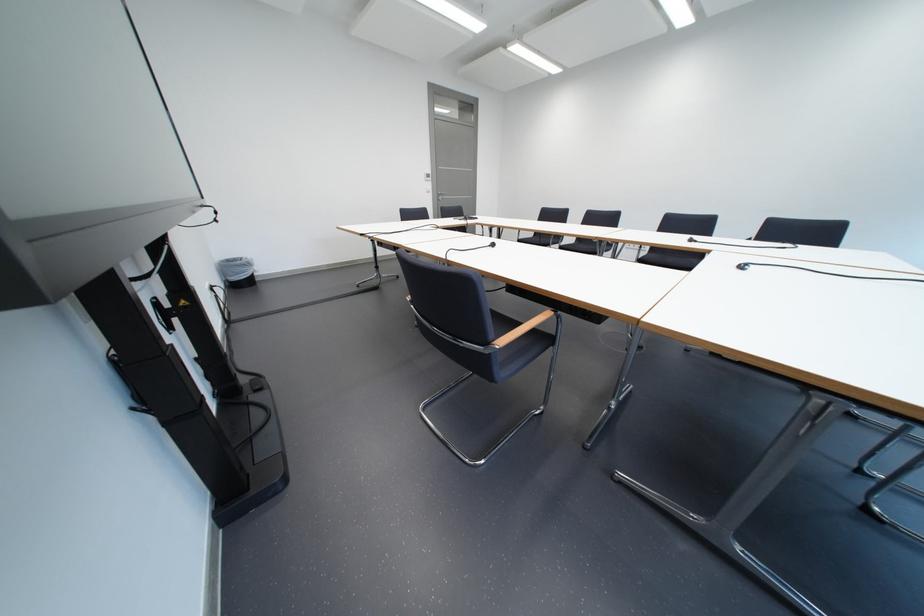
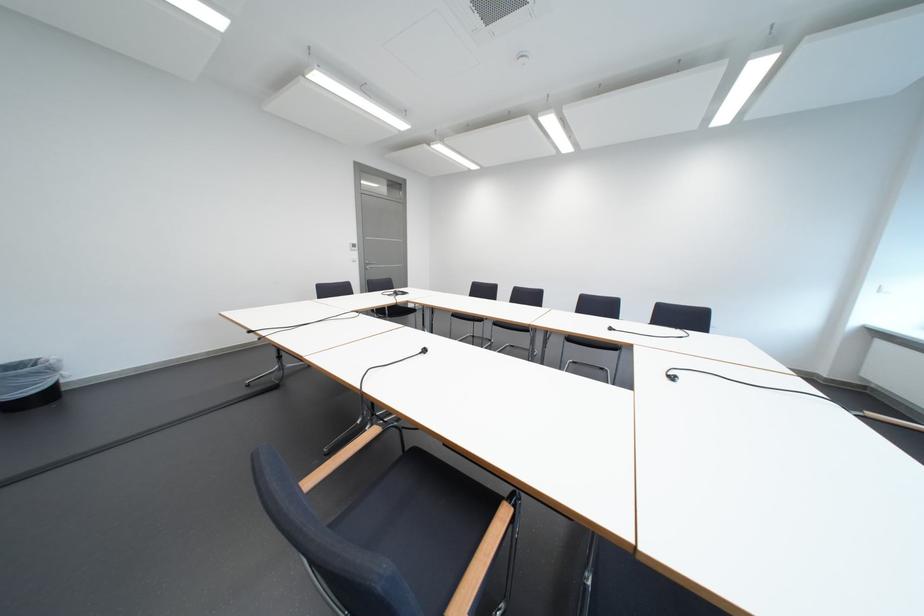
Where in the second image is the point corresponding to point 443,197 from the first image?

(369, 265)